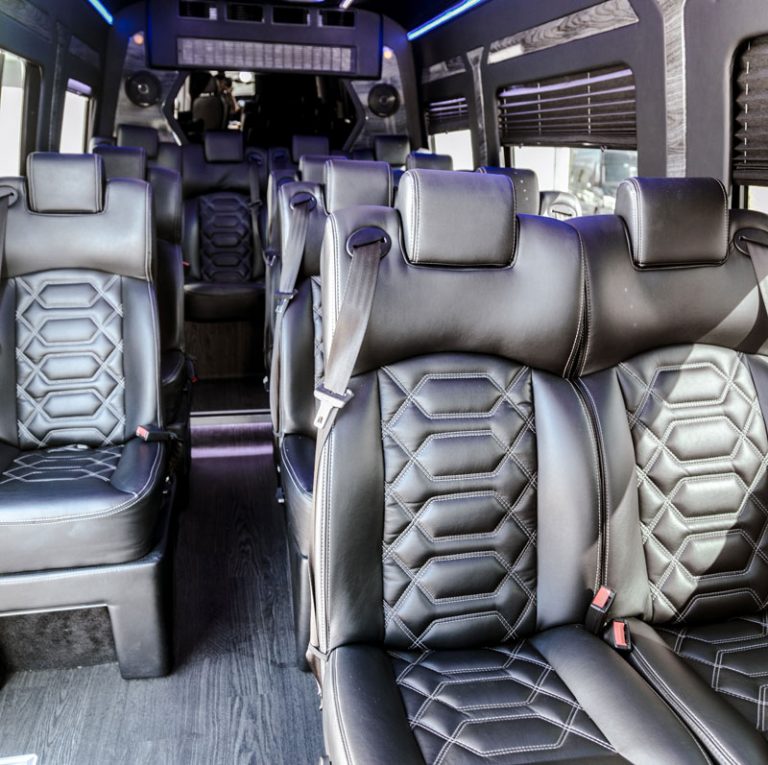
I want to click on windows, so click(570, 174), click(454, 147), click(753, 197), click(27, 112), click(90, 124).